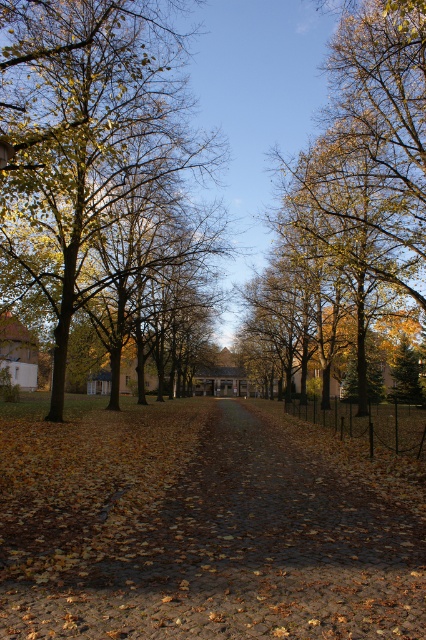
Question: Is brown cobblestone path at center below yellow-green foliage at center?

Choices:
 (A) yes
 (B) no

Answer: (A)

Question: Which point is closer to the camera taking this photo?

Choices:
 (A) (103, 180)
 (B) (216, 492)
 (C) (348, 234)

Answer: (B)

Question: Can you confirm if brown cobblestone path at center is positioned to the right of golden yellow leaves at center?

Choices:
 (A) yes
 (B) no

Answer: (B)

Question: Is brown cobblestone path at center wider than yellow-green foliage at center?

Choices:
 (A) yes
 (B) no

Answer: (A)

Question: Which of these objects is positioned closest to the golden yellow leaves at center?

Choices:
 (A) yellow-green foliage at center
 (B) brown cobblestone path at center

Answer: (A)

Question: Based on their relative distances, which object is farther from the golden yellow leaves at center?

Choices:
 (A) yellow-green foliage at center
 (B) brown cobblestone path at center

Answer: (B)